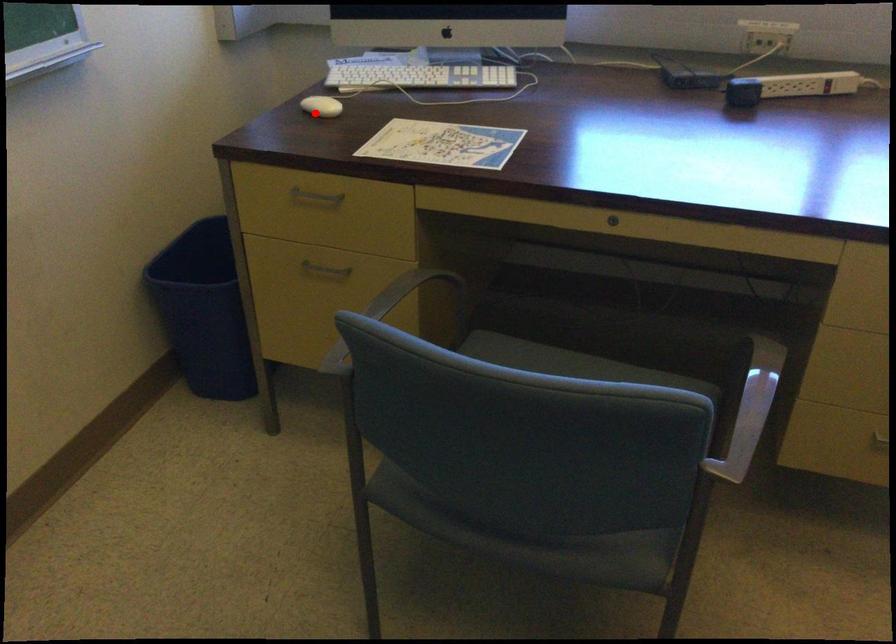
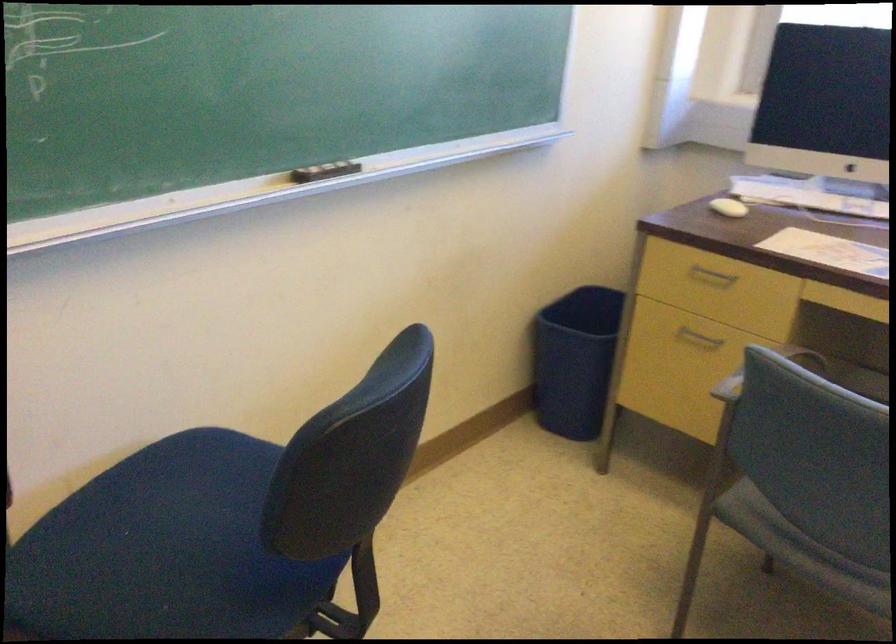
Question: I am providing you with two images of the same scene from different viewpoints. A red point is shown in image1. For the corresponding object point in image2, is it positioned nearer or farther from the camera?

Choices:
 (A) Nearer
 (B) Farther

Answer: (B)